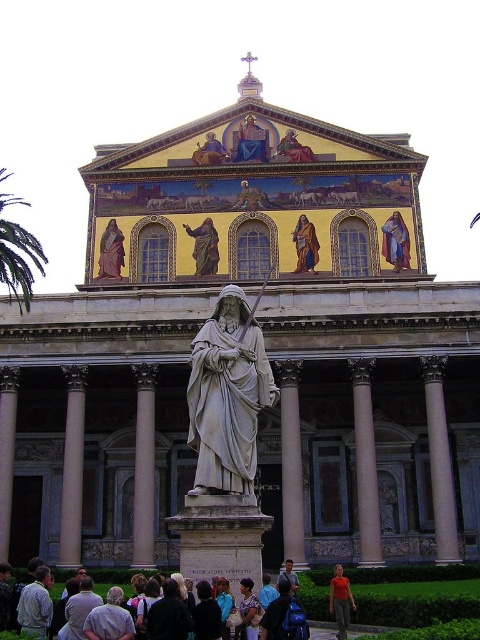
Question: Does smooth stone column at left appear over orange t-shirt at lower center?

Choices:
 (A) yes
 (B) no

Answer: (A)

Question: Which object is the farthest from the gold mosaic figure at upper center?

Choices:
 (A) white marble column at center
 (B) golden textured robe at center
 (C) white marble pillar at center

Answer: (C)

Question: Among these objects, which one is nearest to the camera?

Choices:
 (A) green leafy palm tree at left
 (B) orange t-shirt at lower center
 (C) light gray fabric shirt at lower left

Answer: (C)

Question: Can you confirm if white marble statue at center is positioned above gold mosaic figure at upper center?

Choices:
 (A) no
 (B) yes

Answer: (A)

Question: Which point is farther from the camera taking this photo?

Choices:
 (A) (442, 531)
 (B) (13, 269)
 (C) (192, 397)

Answer: (B)

Question: Is white marble pillar at center to the left of matte gold statue at upper center from the viewer's perspective?

Choices:
 (A) no
 (B) yes

Answer: (B)